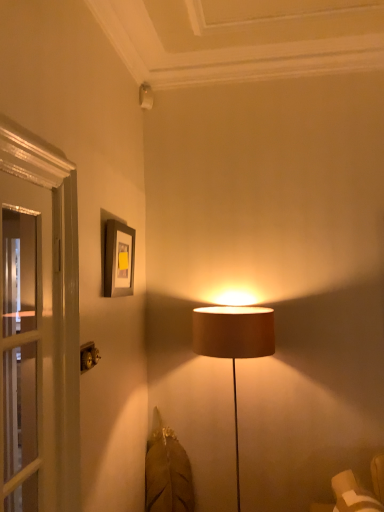
Question: Is metallic gold at lower left taller or shorter than matte gray picture frame at upper left?

Choices:
 (A) short
 (B) tall

Answer: (A)

Question: From a real-world perspective, is metallic gold at lower left positioned above or below matte gray picture frame at upper left?

Choices:
 (A) below
 (B) above

Answer: (A)

Question: In the image, is metallic gold at lower left positioned in front of or behind matte gray picture frame at upper left?

Choices:
 (A) behind
 (B) front

Answer: (B)

Question: Based on their positions, is matte gray picture frame at upper left located to the left or right of metallic gold at lower left?

Choices:
 (A) left
 (B) right

Answer: (B)

Question: Is matte gray picture frame at upper left bigger or smaller than metallic gold at lower left?

Choices:
 (A) big
 (B) small

Answer: (A)

Question: In terms of height, does matte gray picture frame at upper left look taller or shorter compared to metallic gold at lower left?

Choices:
 (A) tall
 (B) short

Answer: (A)

Question: Looking at their shapes, would you say matte gray picture frame at upper left is wider or thinner than metallic gold at lower left?

Choices:
 (A) thin
 (B) wide

Answer: (B)